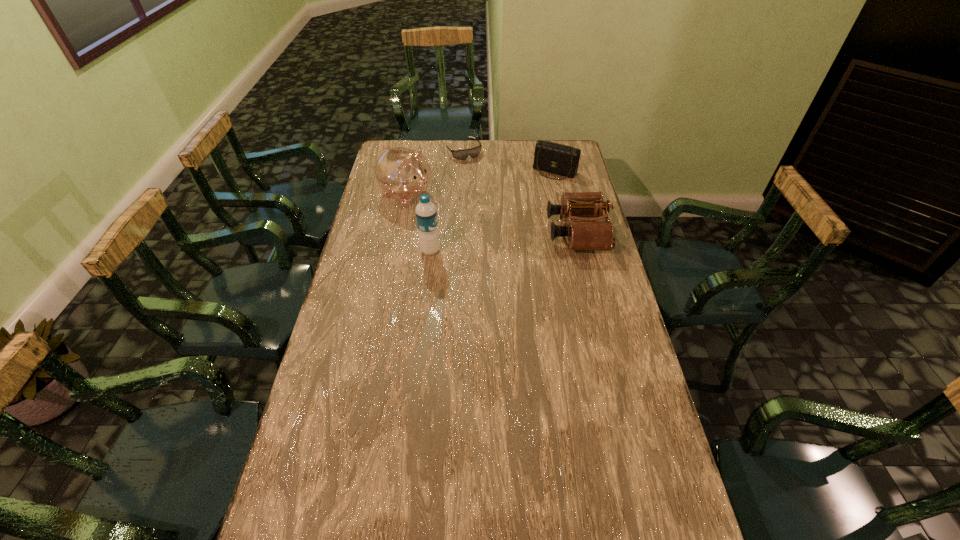
Locate an element on the screen. The width and height of the screenshot is (960, 540). free space between the piggy bank and the clutch bag is located at coordinates (481, 183).

Where is `vacant area between the piggy bank and the third shortest object`? This screenshot has height=540, width=960. vacant area between the piggy bank and the third shortest object is located at coordinates (492, 214).

This screenshot has width=960, height=540. Find the location of `free spot between the piggy bank and the binoculars`. free spot between the piggy bank and the binoculars is located at coordinates (492, 214).

You are a GUI agent. You are given a task and a screenshot of the screen. Output one action in this format:
    pyautogui.click(x=<x>, y=<y>)
    Task: Click on the empty location between the farthest object and the clutch bag
    This screenshot has height=540, width=960.
    Given the screenshot: What is the action you would take?
    pyautogui.click(x=509, y=161)

Where is `free space between the piggy bank and the second shortest object`? This screenshot has width=960, height=540. free space between the piggy bank and the second shortest object is located at coordinates (481, 183).

Find the location of a particular element. This screenshot has height=540, width=960. vacant region between the clutch bag and the piggy bank is located at coordinates (481, 183).

The image size is (960, 540). I want to click on free space between the piggy bank and the goggles, so click(435, 173).

Select which object is the second closest to the piggy bank. Please provide its 2D coordinates. Your answer should be formatted as a tuple, i.e. [(x, y)], where the tuple contains the x and y coordinates of a point satisfying the conditions above.

[(426, 214)]

Point out which object is positioned as the third nearest to the second shortest object. Please provide its 2D coordinates. Your answer should be formatted as a tuple, i.e. [(x, y)], where the tuple contains the x and y coordinates of a point satisfying the conditions above.

[(402, 173)]

Locate an element on the screen. This screenshot has width=960, height=540. blank space that satisfies the following two spatial constraints: 1. on the front side of the binoculars; 2. through the eyepieces of the clutch bag is located at coordinates (568, 233).